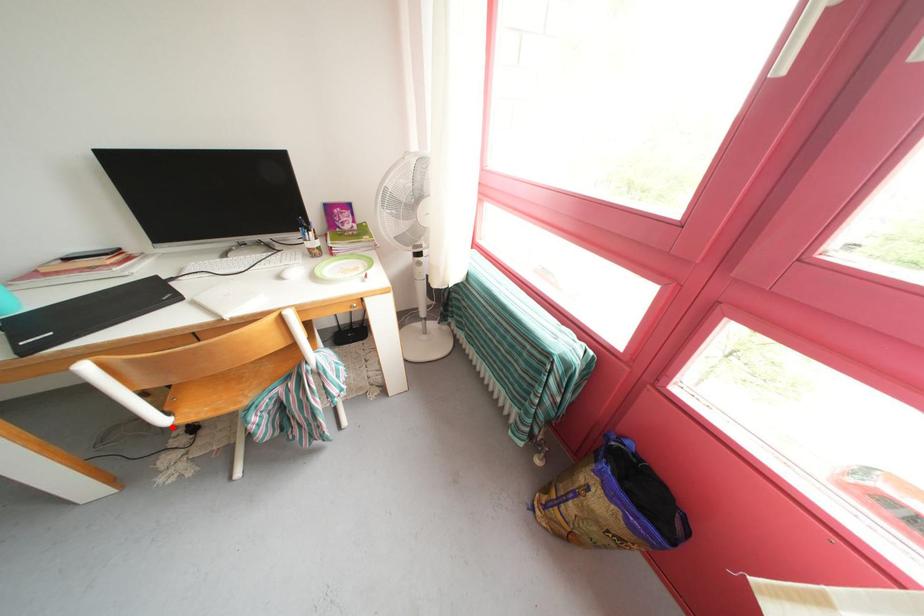
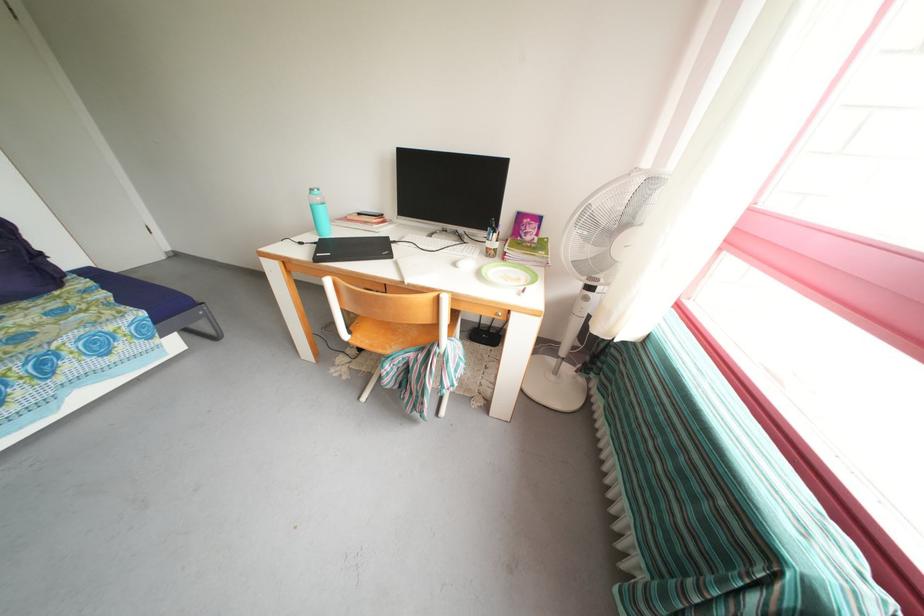
Where in the second image is the point corresponding to the highlighted location from the first image?

(353, 342)